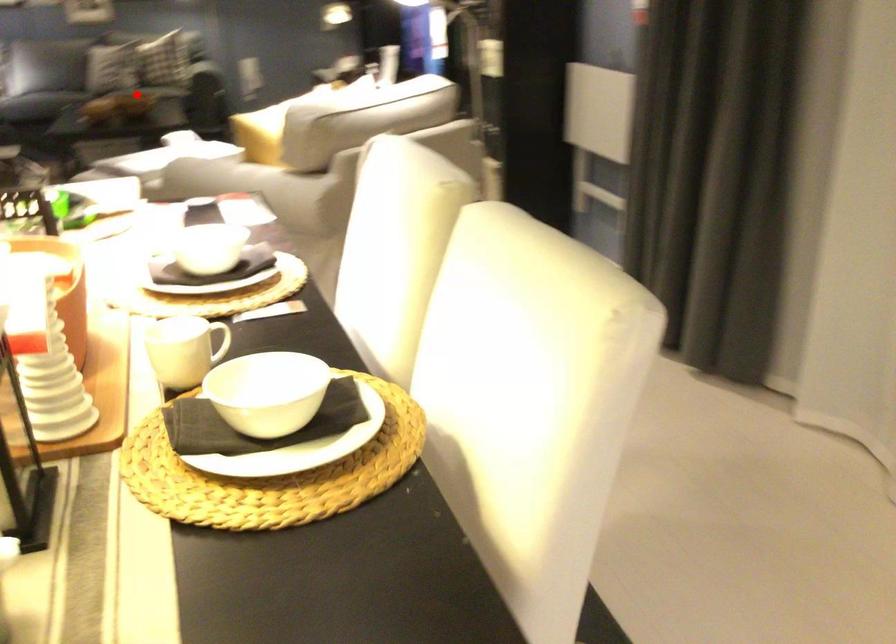
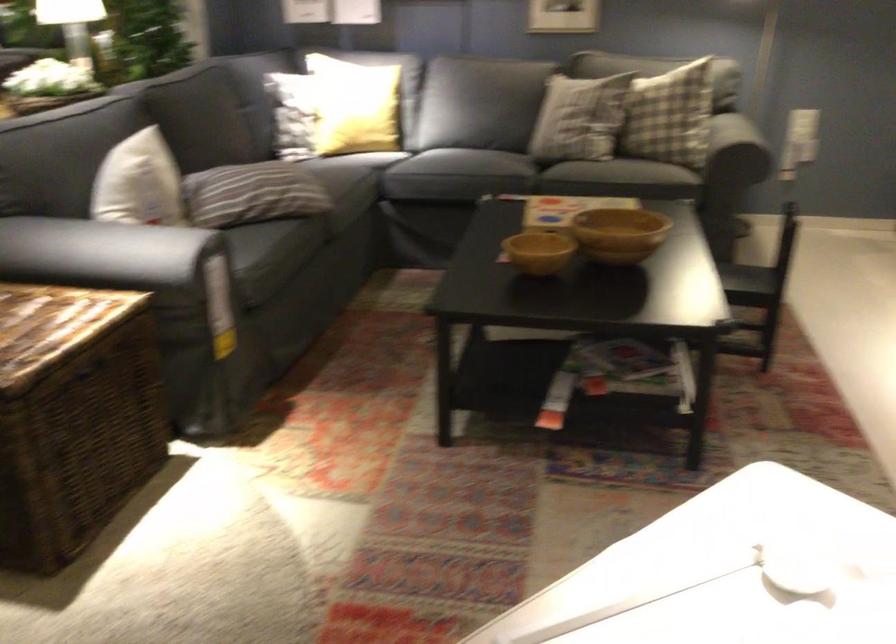
Question: I am providing you with two images of the same scene from different viewpoints. A red point is shown in image1. For the corresponding object point in image2, is it positioned nearer or farther from the camera?

Choices:
 (A) Nearer
 (B) Farther

Answer: (A)